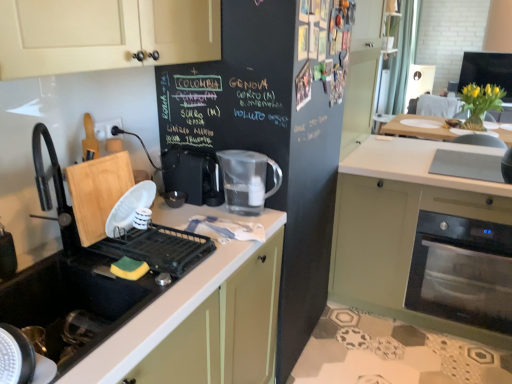
The height and width of the screenshot is (384, 512). What are the coordinates of `free spot to the left of transparent plastic pitcher at center` in the screenshot? It's located at (205, 216).